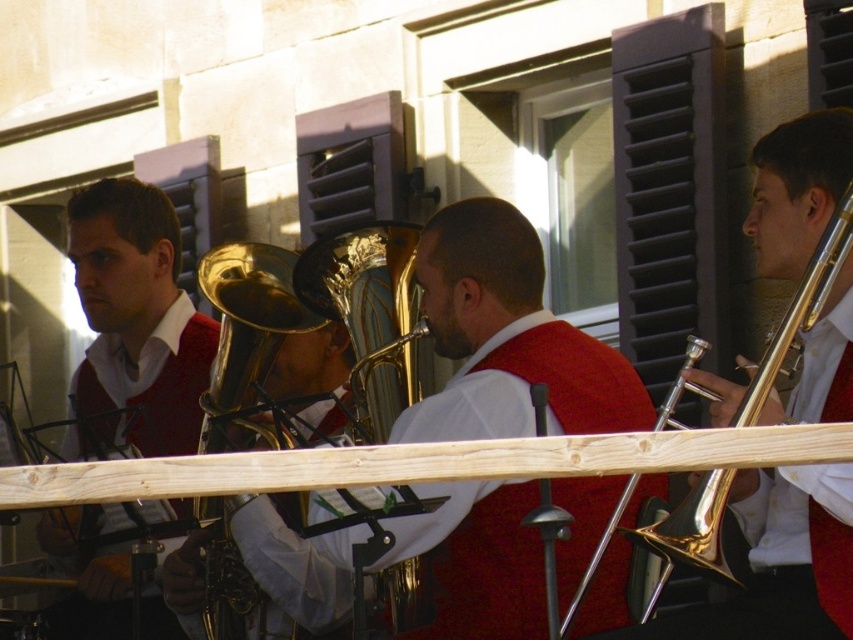
You are standing at the center of the scene and want to move towards the nearest point between point (405,420) and point (120,337). Which point should you move towards?

Point (405,420) is in front of point (120,337), so you should move towards point (405,420) as it is closer to you.

You are a photographer trying to capture the shiny gold tuba at center in your shot. Given that the camera is focused at point 0.5, 0.5, will the tuba be in focus?

The shiny gold tuba at center is at point (508, 339), which is very close to the camera focus point of (426, 320). Therefore, the tuba will likely be in focus.